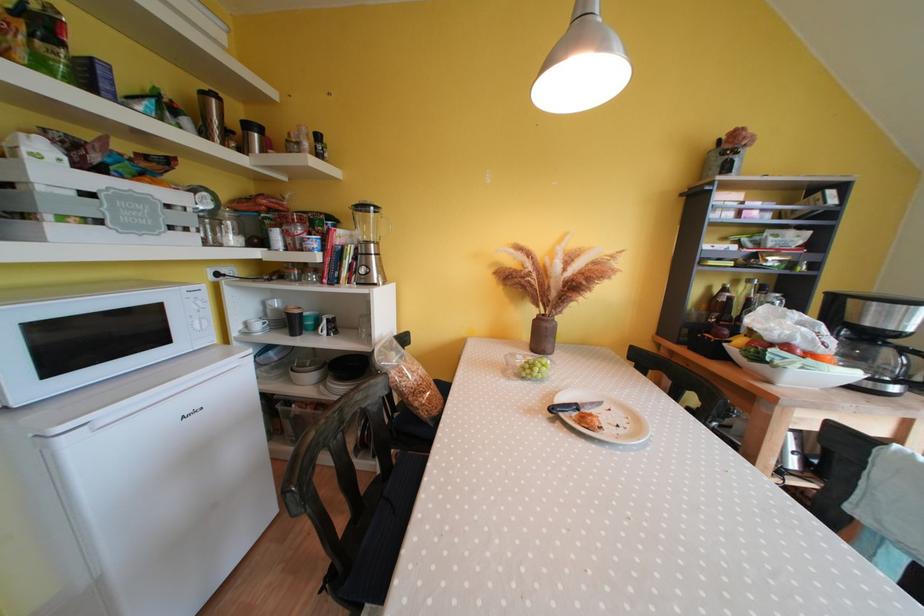
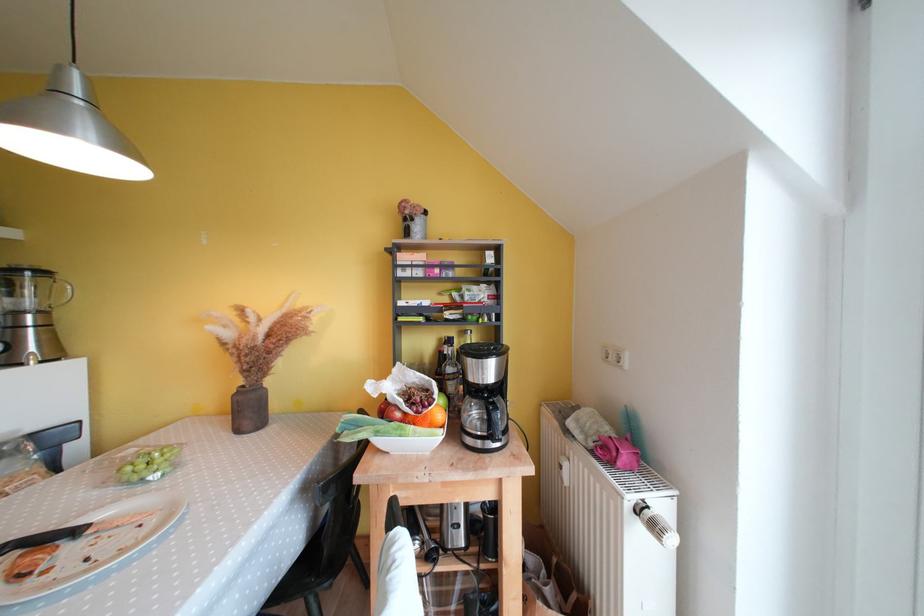
Locate, in the second image, the point that corresponds to (x=582, y=410) in the first image.

(83, 535)